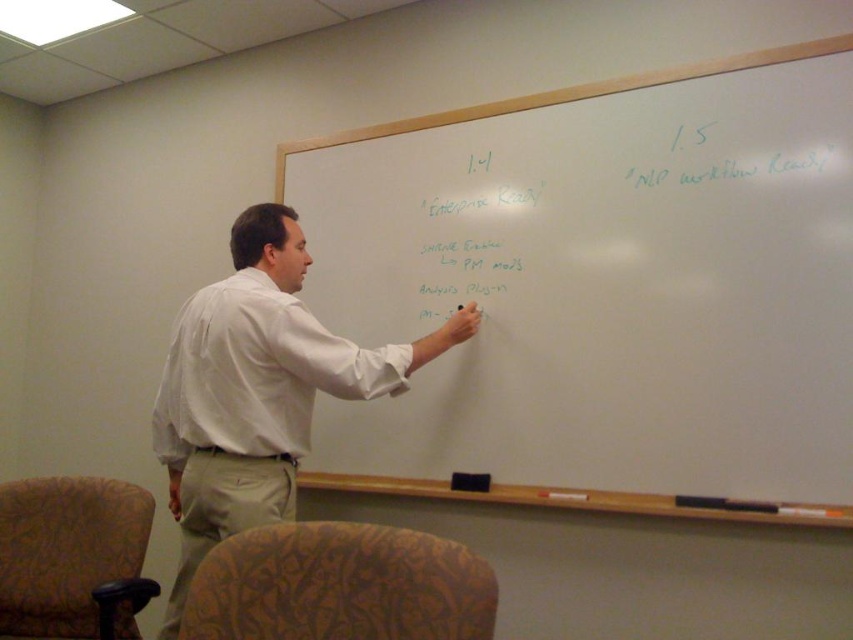
Question: Is whiteboard at upper center wider than white cotton shirt at center?

Choices:
 (A) yes
 (B) no

Answer: (A)

Question: Considering the real-world distances, which object is farthest from the white cotton shirt at center?

Choices:
 (A) white matte text at center
 (B) patterned fabric armchair at lower left

Answer: (A)

Question: Does whiteboard at upper center have a greater width compared to patterned fabric armchair at lower left?

Choices:
 (A) yes
 (B) no

Answer: (A)

Question: Does white cotton shirt at center appear on the left side of patterned fabric armchair at lower left?

Choices:
 (A) no
 (B) yes

Answer: (A)

Question: Estimate the real-world distances between objects in this image. Which object is closer to the whiteboard at upper center?

Choices:
 (A) velvet-patterned armchair at lower left
 (B) white matte text at center

Answer: (B)

Question: Which point is farther from the camera taking this photo?

Choices:
 (A) (24, 620)
 (B) (334, 412)
 (C) (454, 291)
 (D) (277, 596)

Answer: (B)